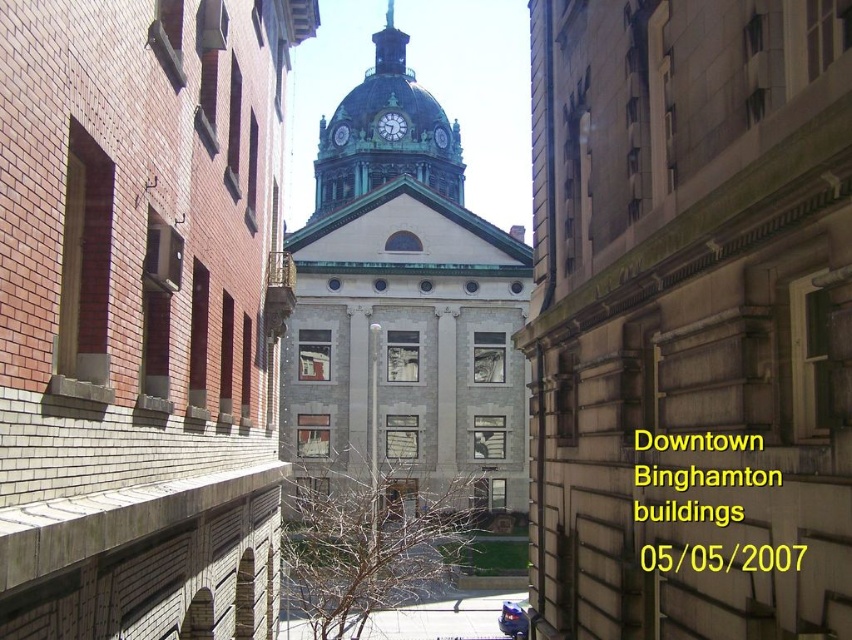
Question: Which is nearer to the gray stone clock tower at center?

Choices:
 (A) green glass clock at center
 (B) green patina clock tower at center
 (C) green copper spire at center
 (D) green stone clock at center

Answer: (B)

Question: Is gray stone clock tower at center bigger than green glass clock at center?

Choices:
 (A) yes
 (B) no

Answer: (A)

Question: Considering the real-world distances, which object is farthest from the green metallic clock at center?

Choices:
 (A) green glass clock at center
 (B) gray stone clock tower at center

Answer: (B)

Question: Is green patina clock tower at center positioned behind green metallic clock at center?

Choices:
 (A) no
 (B) yes

Answer: (A)

Question: Which of the following is the closest to the observer?

Choices:
 (A) green stone clock at center
 (B) green metallic clock at center
 (C) green glass clock at center

Answer: (C)

Question: Is green copper spire at center closer to camera compared to green stone clock at center?

Choices:
 (A) no
 (B) yes

Answer: (A)